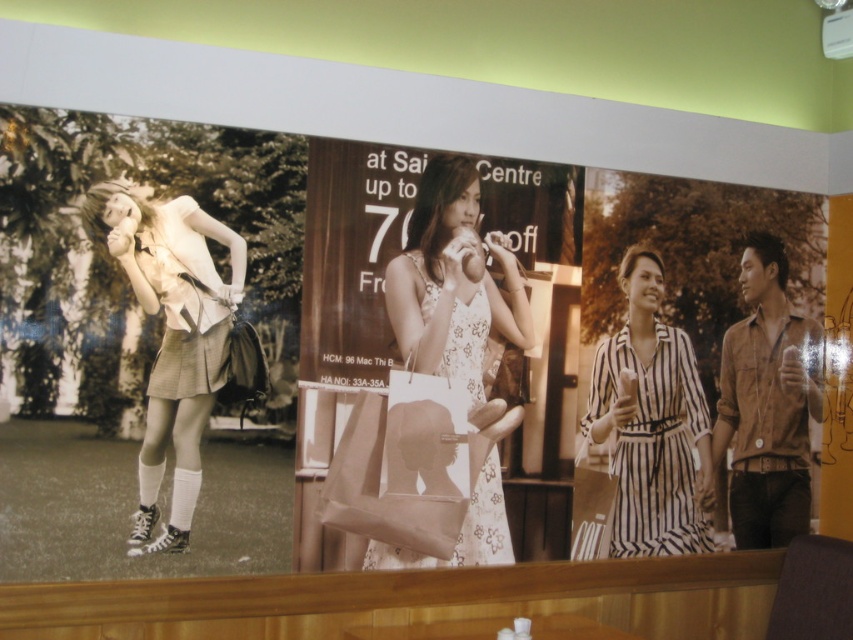
Who is higher up, striped fabric dress at center or brown textured shirt at right?

brown textured shirt at right is above.

Is striped fabric dress at center taller than brown textured shirt at right?

No, striped fabric dress at center is not taller than brown textured shirt at right.

Who is more forward, (613, 468) or (814, 333)?

Positioned in front is point (613, 468).

The width and height of the screenshot is (853, 640). I want to click on striped fabric dress at center, so click(x=651, y=422).

Can you confirm if plaid skirt at left is positioned to the right of white floral dress at center?

In fact, plaid skirt at left is to the left of white floral dress at center.

Can you confirm if plaid skirt at left is taller than white floral dress at center?

No.

Image resolution: width=853 pixels, height=640 pixels. Identify the location of plaid skirt at left. (173, 337).

Between white floral dress at center and brown textured shirt at right, which one has more height?

white floral dress at center

Between white floral dress at center and brown textured shirt at right, which one appears on the left side from the viewer's perspective?

From the viewer's perspective, white floral dress at center appears more on the left side.

Where is `white floral dress at center`? white floral dress at center is located at coordinates (453, 282).